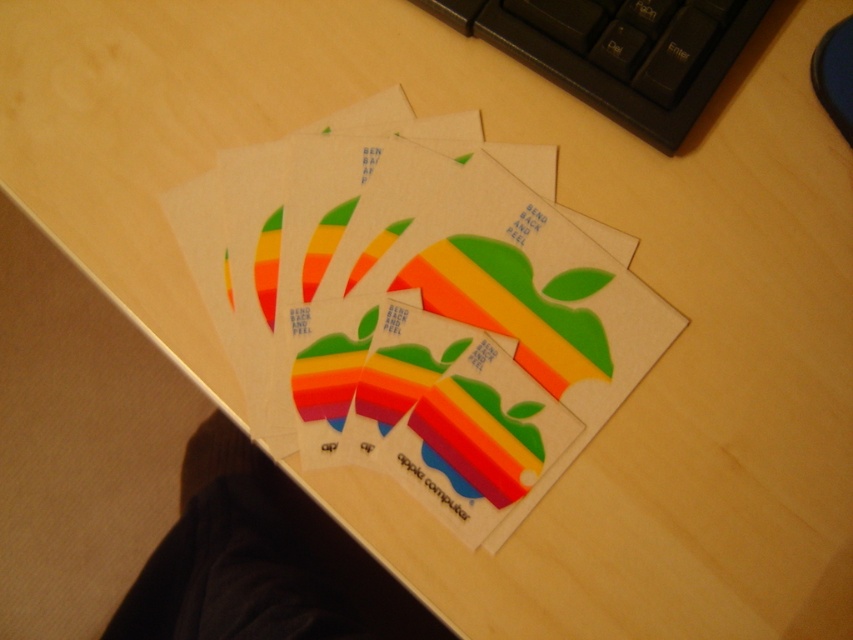
Does matte paper card at center have a lesser width compared to black plastic keyboard at upper center?

No, matte paper card at center is not thinner than black plastic keyboard at upper center.

Does matte paper card at center have a greater width compared to black plastic keyboard at upper center?

Yes.

Is point (434, 404) positioned in front of point (577, 67)?

Yes, it is in front of point (577, 67).

The image size is (853, 640). Find the location of `matte paper card at center`. matte paper card at center is located at coordinates (415, 310).